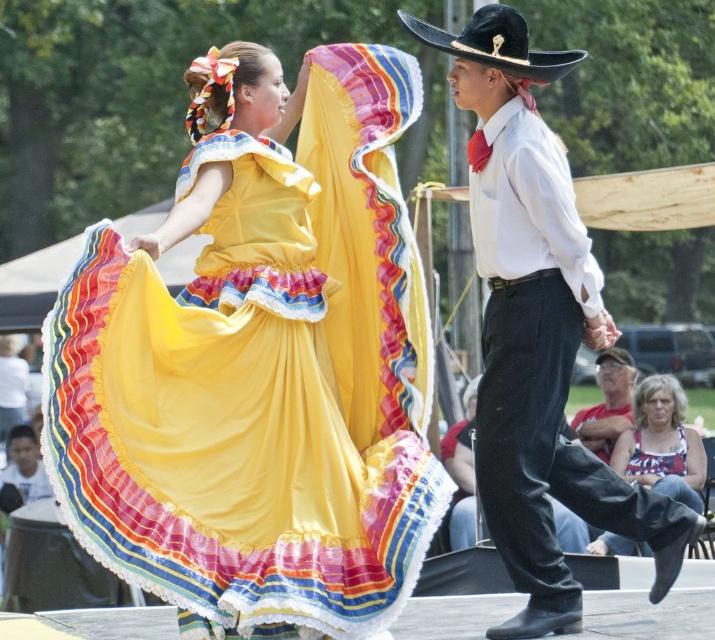
You are an AI analyzing the stage performance. The stage is a rectangular area with coordinates from 0 to 1 on both axes. The center of the stage is at point 0.5, 0.5. Where is the black felt cowboy hat at upper center located relative to the center of the stage?

The black felt cowboy hat at upper center is located at point (495, 44), which is to the left and above the center of the stage at (357, 320).

You are a photographer standing at the back of the stage trying to capture a clear photo of the dancer on the left. There is a point at coordinates point (x=495, y=44) that might be blocking your view. Is this point part of the dancer on the left or the dancer on the right?

The point (x=495, y=44) is on the black felt cowboy hat at upper center of the dancer on the right, so it belongs to the dancer on the right.

From the picture: You are a stagehand preparing to adjust the height of a platform so that both the white cotton shirt at center and the gray fabric cap at lower right are visible to the audience. Based on their heights, which object should be placed higher on the platform to ensure both are visible?

The white cotton shirt at center is taller than the gray fabric cap at lower right. To ensure both are visible, place the gray fabric cap at lower right higher on the platform since it is shorter. This way, both will be at a similar visible height from the audience.